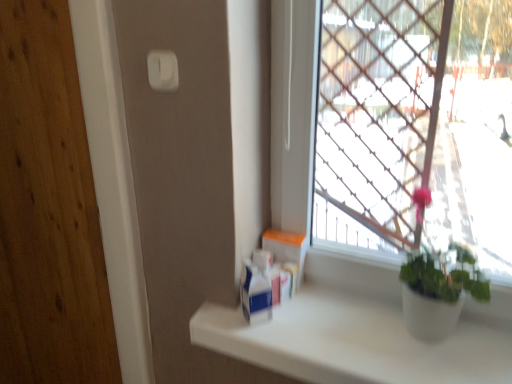
You are a GUI agent. You are given a task and a screenshot of the screen. Output one action in this format:
    pyautogui.click(x=<x>, y=<y>)
    Task: Click on the free space in front of white plastic container at center
    
    Given the screenshot: What is the action you would take?
    pyautogui.click(x=305, y=334)